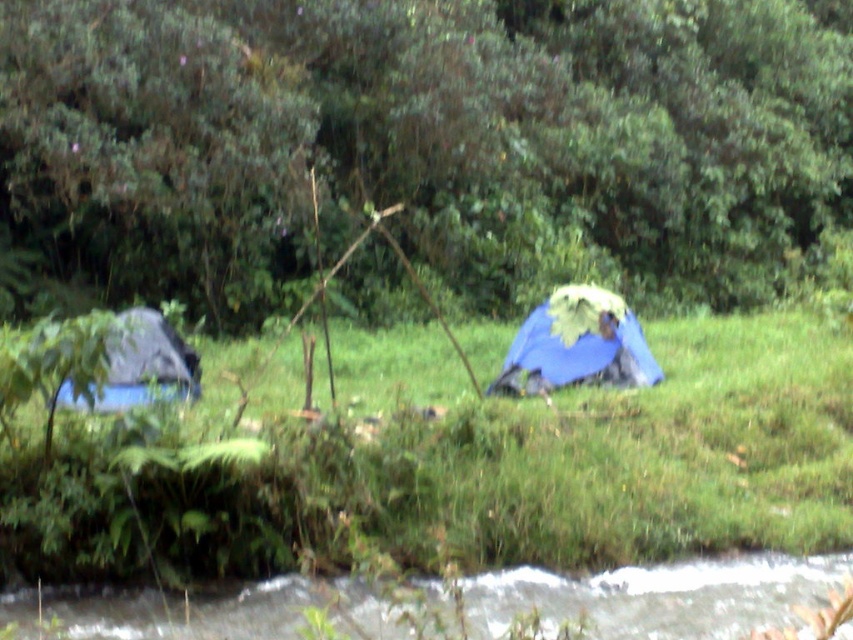
Does white frothy water at lower center lie behind blue fabric tent at center?

No, white frothy water at lower center is in front of blue fabric tent at center.

Who is more distant from viewer, [726,627] or [564,298]?

Positioned behind is point [564,298].

Between point (45, 609) and point (540, 317), which one is positioned in front?

Positioned in front is point (45, 609).

Locate an element on the screen. white frothy water at lower center is located at coordinates (660, 595).

Between point (842, 35) and point (136, 355), which one is positioned behind?

The point (842, 35) is more distant.

From the picture: Can you confirm if green leafy tree at upper center is bigger than blue fabric tent at left?

Indeed, green leafy tree at upper center has a larger size compared to blue fabric tent at left.

This screenshot has height=640, width=853. What do you see at coordinates (422, 145) in the screenshot?
I see `green leafy tree at upper center` at bounding box center [422, 145].

Where is `green leafy tree at upper center`? This screenshot has height=640, width=853. green leafy tree at upper center is located at coordinates (422, 145).

Is point (372, 262) closer to viewer compared to point (583, 323)?

No, it is not.

Is green leafy tree at upper center thinner than blue fabric tent at center?

No, green leafy tree at upper center is not thinner than blue fabric tent at center.

Image resolution: width=853 pixels, height=640 pixels. In order to click on green leafy tree at upper center in this screenshot , I will do `click(422, 145)`.

You are a GUI agent. You are given a task and a screenshot of the screen. Output one action in this format:
    pyautogui.click(x=<x>, y=<y>)
    Task: Click on the green leafy tree at upper center
    This screenshot has height=640, width=853.
    Given the screenshot: What is the action you would take?
    pyautogui.click(x=422, y=145)